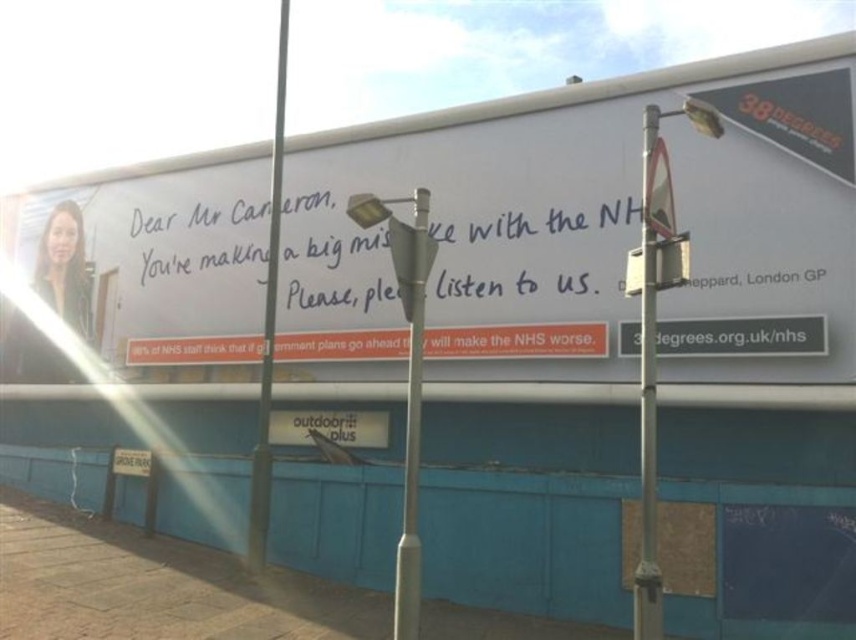
In the scene shown: How much distance is there between metallic gray pole at center and black plastic sign at lower center?

2.76 meters

Can you confirm if metallic gray pole at center is positioned below black plastic sign at lower center?

Incorrect, metallic gray pole at center is not positioned below black plastic sign at lower center.

This screenshot has height=640, width=856. What do you see at coordinates (412, 426) in the screenshot?
I see `metallic gray pole at center` at bounding box center [412, 426].

Locate an element on the screen. The width and height of the screenshot is (856, 640). metallic gray pole at center is located at coordinates (412, 426).

Does metallic silver pole at right have a lesser height compared to metallic pole at center?

Yes, metallic silver pole at right is shorter than metallic pole at center.

Between metallic silver pole at right and metallic pole at center, which one is positioned higher?

Positioned higher is metallic pole at center.

Which is behind, point (648, 568) or point (256, 486)?

The point (256, 486) is behind.

You are a GUI agent. You are given a task and a screenshot of the screen. Output one action in this format:
    pyautogui.click(x=<x>, y=<y>)
    Task: Click on the metallic silver pole at right
    The image size is (856, 640).
    Given the screenshot: What is the action you would take?
    pyautogui.click(x=648, y=404)

Is white paper billboard at upper center to the right of black plastic sign at lower center from the viewer's perspective?

Incorrect, white paper billboard at upper center is not on the right side of black plastic sign at lower center.

Between white paper billboard at upper center and black plastic sign at lower center, which one has more height?

white paper billboard at upper center is taller.

Is point (134, 218) closer to viewer compared to point (379, 436)?

That is False.

Locate an element on the screen. The width and height of the screenshot is (856, 640). white paper billboard at upper center is located at coordinates (495, 200).